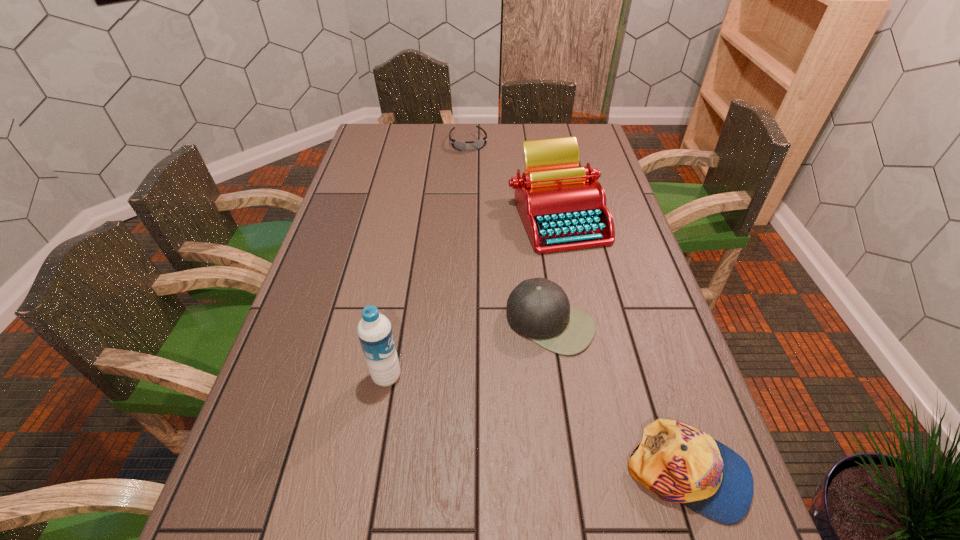
Where is `cap at the right edge`? The height and width of the screenshot is (540, 960). cap at the right edge is located at coordinates (677, 462).

Image resolution: width=960 pixels, height=540 pixels. I want to click on typewriter at the right edge, so click(x=563, y=207).

Identify the location of object at the near right corner. (677, 462).

At what (x,y) coordinates should I click in order to perform the action: click on vacant space at the far edge. Please return your answer as a coordinate pair (x, y). The image size is (960, 540). Looking at the image, I should click on (467, 133).

Locate an element on the screen. This screenshot has width=960, height=540. vacant area at the near edge of the desktop is located at coordinates (586, 500).

Identify the location of free space at the left edge. This screenshot has height=540, width=960. (385, 204).

Where is `free space at the right edge`? This screenshot has height=540, width=960. free space at the right edge is located at coordinates point(600,299).

At what (x,y) coordinates should I click in order to perform the action: click on vacant space at the far left corner of the desktop. Please return your answer as a coordinate pair (x, y). This screenshot has width=960, height=540. Looking at the image, I should click on (366, 141).

In order to click on vacant space at the near left corner in this screenshot , I will do `click(270, 498)`.

This screenshot has width=960, height=540. I want to click on unoccupied area between the fourth farthest object and the fourth nearest object, so click(x=471, y=296).